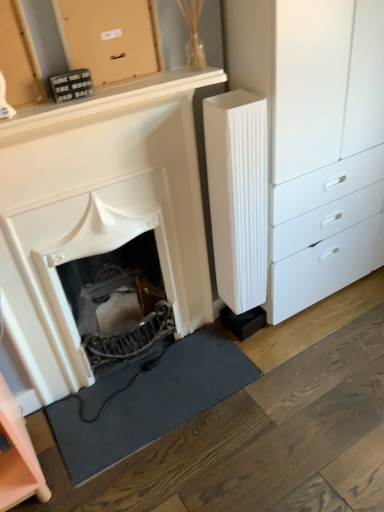
The image size is (384, 512). In order to click on free point in front of wooden board at upper center, placed as the 2th cabinetry when sorted from bottom to top in this screenshot , I will do `click(100, 91)`.